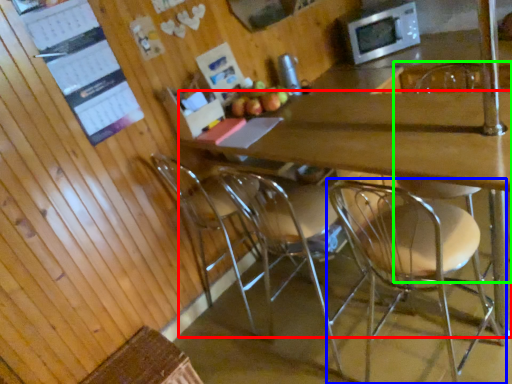
Question: Based on their relative distances, which object is farther from desk (highlighted by a red box)? Choose from chair (highlighted by a blue box) and chair (highlighted by a green box).

Choices:
 (A) chair
 (B) chair

Answer: (B)